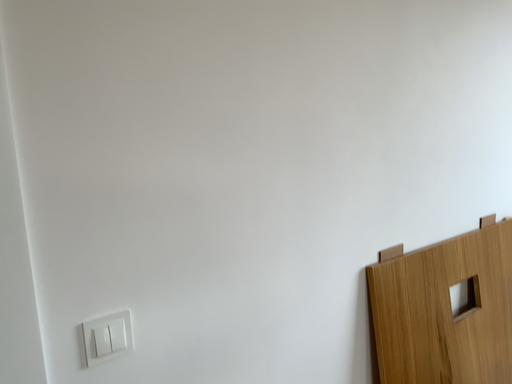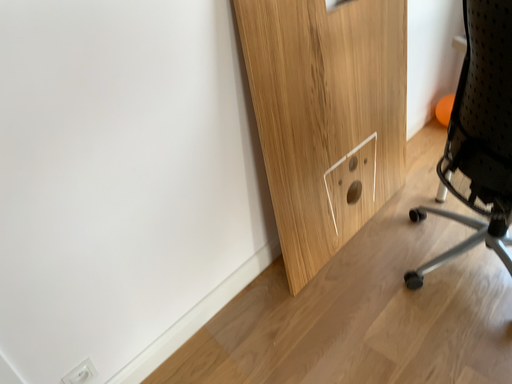
Question: How did the camera likely rotate when shooting the video?

Choices:
 (A) rotated left
 (B) rotated right

Answer: (B)